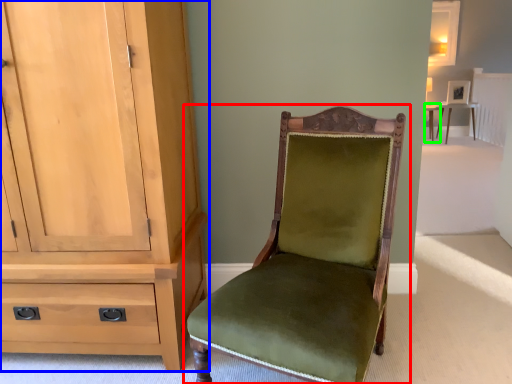
Question: Based on their relative distances, which object is farther from chair (highlighted by a red box)? Choose from cabinetry (highlighted by a blue box) and table (highlighted by a green box).

Choices:
 (A) cabinetry
 (B) table

Answer: (B)